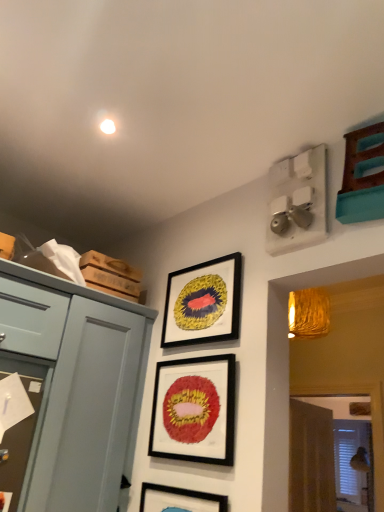
Question: From a real-world perspective, is matte blue drawer at left physically located above or below matte blue cabinet at left?

Choices:
 (A) below
 (B) above

Answer: (B)

Question: Based on their positions, is matte blue drawer at left located to the left or right of matte blue cabinet at left?

Choices:
 (A) left
 (B) right

Answer: (A)

Question: Which object is positioned closest to the matte black picture frame at center, which is the 2th picture frame in top-to-bottom order?

Choices:
 (A) brown textured curtain at lower right
 (B) matte blue cabinet at left
 (C) matte blue drawer at left
 (D) matte black picture frame at upper center, the third picture frame in the bottom-to-top sequence
 (E) matte black picture frame at center, which ranks as the 3th picture frame in top-to-bottom order

Answer: (E)

Question: Based on their relative distances, which object is farther from the matte black picture frame at center, placed as the 1th picture frame when sorted from bottom to top?

Choices:
 (A) brown textured curtain at lower right
 (B) matte black picture frame at center, which is the 2th picture frame in top-to-bottom order
 (C) matte blue cabinet at left
 (D) matte black picture frame at upper center, which appears as the 1th picture frame when viewed from the top
 (E) matte blue drawer at left

Answer: (A)